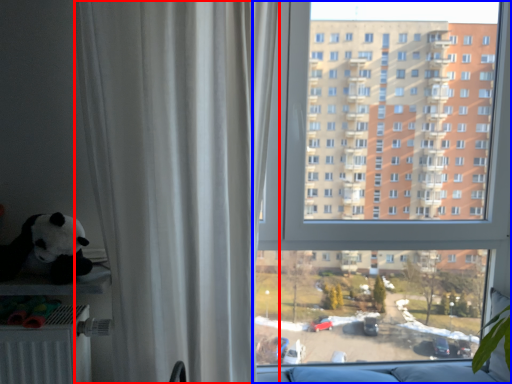
Question: Which point is closer to the camera, curtain (highlighted by a red box) or window (highlighted by a blue box)?

Choices:
 (A) curtain
 (B) window

Answer: (A)